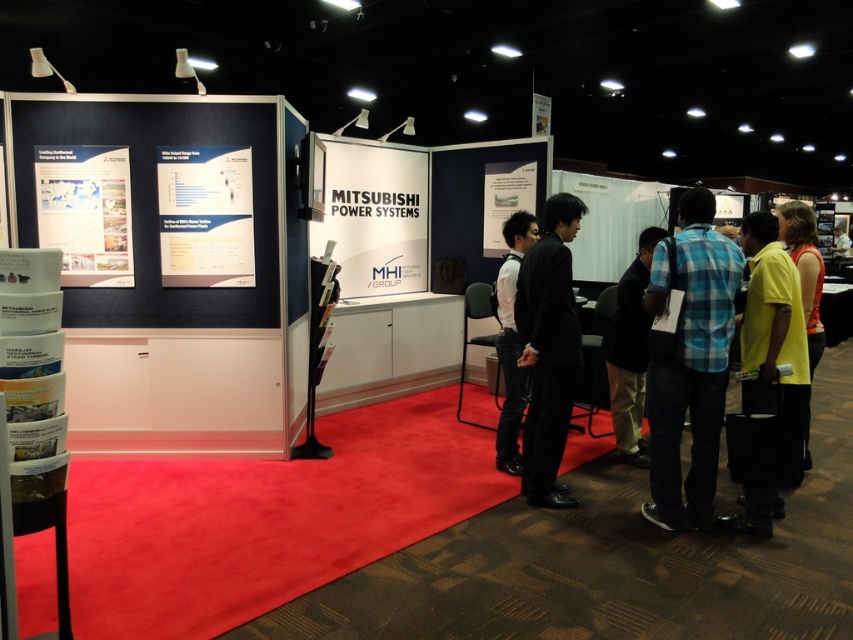
Where is `white paper poster at upper left`? The height and width of the screenshot is (640, 853). white paper poster at upper left is located at coordinates (206, 216).

This screenshot has width=853, height=640. What do you see at coordinates (206, 216) in the screenshot?
I see `white paper poster at upper left` at bounding box center [206, 216].

Which is behind, point (161, 200) or point (102, 209)?

Point (161, 200)

Where is `white paper poster at upper left`? The width and height of the screenshot is (853, 640). white paper poster at upper left is located at coordinates (206, 216).

Between point (99, 156) and point (543, 131), which one is positioned in front?

Positioned in front is point (99, 156).

Where is `matte paper poster at upper left`? This screenshot has height=640, width=853. matte paper poster at upper left is located at coordinates (85, 212).

Is point (647, 314) closer to camera compared to point (525, 230)?

Yes.

Locate an element on the screen. The image size is (853, 640). blue plaid shirt at right is located at coordinates (630, 352).

Who is more forward, (619, 381) or (508, 372)?

Positioned in front is point (508, 372).

Locate an element on the screen. blue plaid shirt at right is located at coordinates (630, 352).